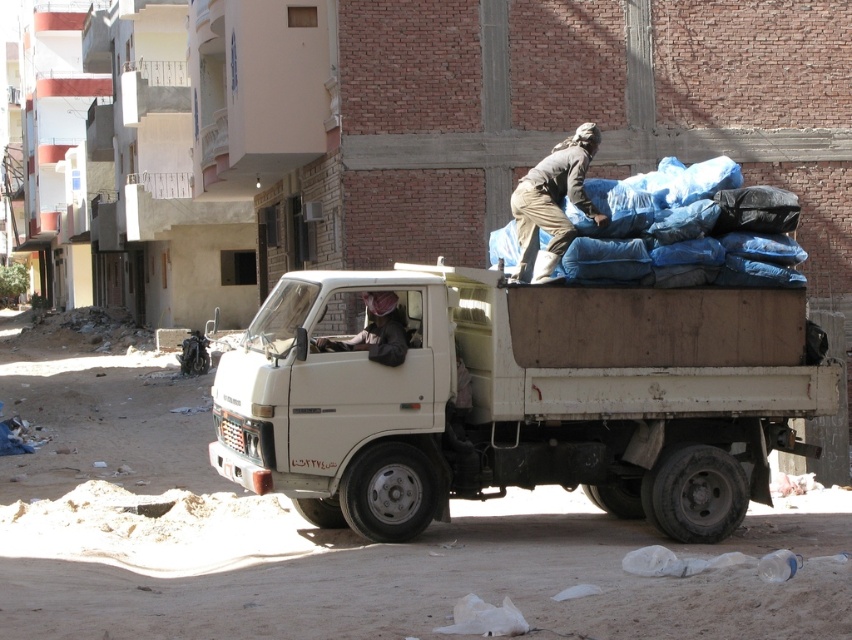
Question: Is white matte truck at center positioned behind brown leather jacket at center?

Choices:
 (A) no
 (B) yes

Answer: (A)

Question: Which of the following is the farthest from the observer?

Choices:
 (A) (314, 448)
 (B) (623, 237)

Answer: (B)

Question: Does dark brown fabric at upper right have a smaller size compared to brown leather jacket at center?

Choices:
 (A) yes
 (B) no

Answer: (A)

Question: Which object appears closest to the camera in this image?

Choices:
 (A) blue tarpaulin bags at upper right
 (B) brown leather jacket at center

Answer: (B)

Question: Can you confirm if white matte truck at center is thinner than brown leather jacket at center?

Choices:
 (A) no
 (B) yes

Answer: (A)

Question: Based on their relative distances, which object is farther from the white matte truck at center?

Choices:
 (A) brown leather jacket at center
 (B) blue tarpaulin bags at upper right
 (C) dark brown fabric at upper right

Answer: (C)